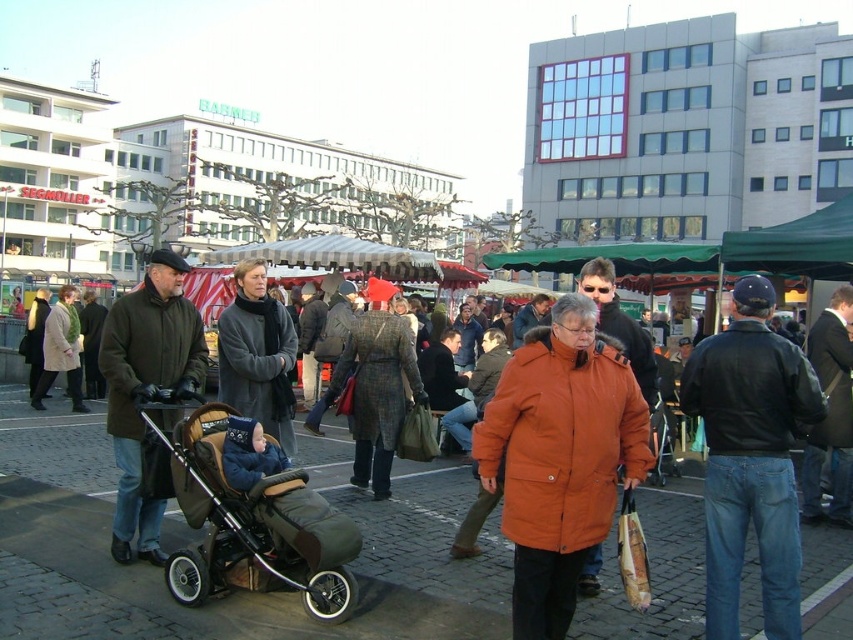
Can you confirm if black leather jacket at right is wider than light beige wool coat at center?

In fact, black leather jacket at right might be narrower than light beige wool coat at center.

Between point (782, 387) and point (57, 300), which one is positioned in front?

Positioned in front is point (782, 387).

This screenshot has width=853, height=640. Find the location of `black leather jacket at right`. black leather jacket at right is located at coordinates (750, 458).

Consider the image. Is black leather jacket at right below dark brown leather coat at left?

Correct, black leather jacket at right is located below dark brown leather coat at left.

Can you confirm if black leather jacket at right is taller than dark brown leather coat at left?

Yes.

Is point (764, 326) positioned after point (152, 337)?

No, (764, 326) is in front of (152, 337).

This screenshot has width=853, height=640. What are the coordinates of `black leather jacket at right` in the screenshot? It's located at (750, 458).

Is orange matte coat at center bigger than dark brown leather coat at left?

Yes, orange matte coat at center is bigger than dark brown leather coat at left.

Is orange matte coat at center further to camera compared to dark brown leather coat at left?

No, it is not.

Describe the element at coordinates (560, 458) in the screenshot. I see `orange matte coat at center` at that location.

Identify the location of orange matte coat at center. (560, 458).